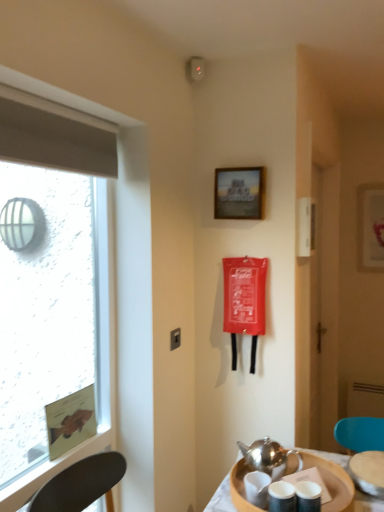
Question: Considering the positions of point (6, 457) and point (364, 456), is point (6, 457) closer or farther from the camera than point (364, 456)?

Choices:
 (A) farther
 (B) closer

Answer: (A)

Question: Considering the positions of transparent glass window at left and metallic silver teapot at lower right in the image, is transparent glass window at left taller or shorter than metallic silver teapot at lower right?

Choices:
 (A) short
 (B) tall

Answer: (B)

Question: Estimate the real-world distances between objects in this image. Which object is farther from the white glossy picture frame at upper right, which is the first picture frame from right to left?

Choices:
 (A) wooden frame at upper center, marked as the 2th picture frame in a back-to-front arrangement
 (B) polished silver teapot at lower center
 (C) wooden tray at lower right
 (D) transparent glass window at left
 (E) metallic silver teapot at lower right

Answer: (D)

Question: Which of these objects is positioned closest to the wooden frame at upper center, marked as the 2th picture frame in a back-to-front arrangement?

Choices:
 (A) metallic silver teapot at lower right
 (B) polished silver teapot at lower center
 (C) white glossy picture frame at upper right, placed as the second picture frame when sorted from left to right
 (D) wooden tray at lower right
 (E) transparent glass window at left

Answer: (E)